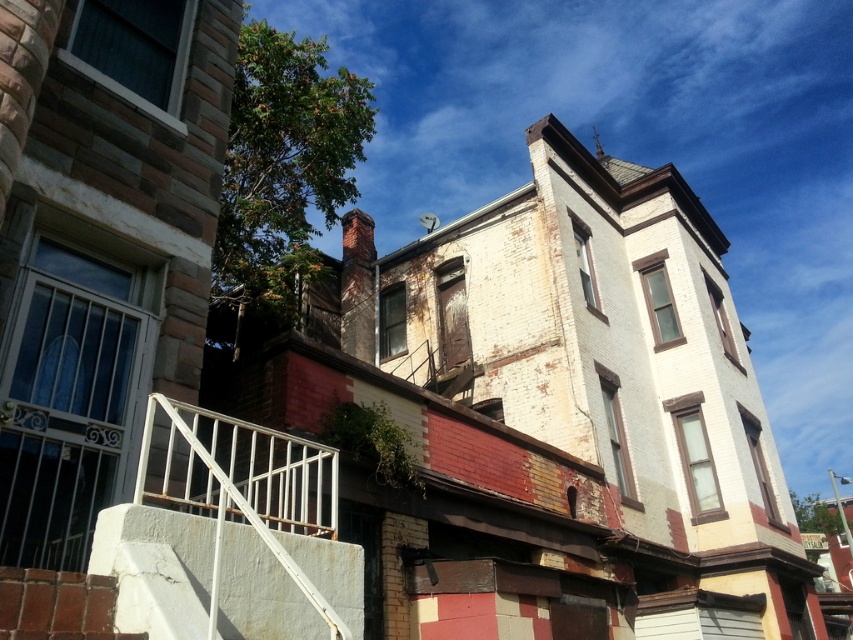
Question: Which object appears closest to the camera in this image?

Choices:
 (A) white metal railing at lower left
 (B) white concrete stairs at lower left

Answer: (A)

Question: Is white concrete stairs at lower left below white metal railing at lower left?

Choices:
 (A) yes
 (B) no

Answer: (A)

Question: From the image, what is the correct spatial relationship of white concrete stairs at lower left in relation to white metal railing at lower left?

Choices:
 (A) below
 (B) above

Answer: (A)

Question: Which point is closer to the camera?

Choices:
 (A) (277, 566)
 (B) (196, 417)

Answer: (A)

Question: Can you confirm if white concrete stairs at lower left is positioned below white metal railing at lower left?

Choices:
 (A) no
 (B) yes

Answer: (B)